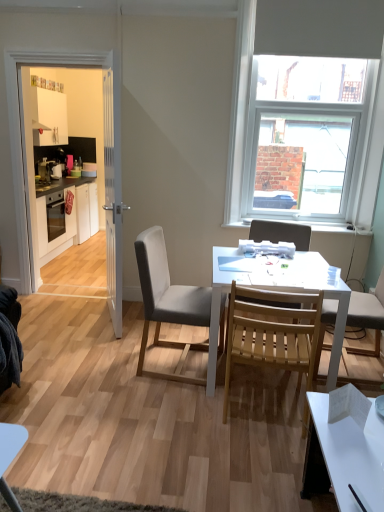
Question: Considering the relative sizes of white wooden door at left and white glossy door at left in the image provided, is white wooden door at left thinner than white glossy door at left?

Choices:
 (A) yes
 (B) no

Answer: (B)

Question: Is white glossy door at left located within white wooden door at left?

Choices:
 (A) no
 (B) yes

Answer: (A)

Question: From the image's perspective, is white wooden door at left under white glossy door at left?

Choices:
 (A) yes
 (B) no

Answer: (A)

Question: Can you confirm if white wooden door at left is bigger than white glossy door at left?

Choices:
 (A) yes
 (B) no

Answer: (A)

Question: Does white wooden door at left have a lesser height compared to white glossy door at left?

Choices:
 (A) no
 (B) yes

Answer: (B)

Question: Is white wooden door at left aimed at white glossy door at left?

Choices:
 (A) no
 (B) yes

Answer: (A)

Question: Does wooden slats chair at center, marked as the third chair in a left-to-right arrangement, have a greater height compared to white matte window at upper right?

Choices:
 (A) yes
 (B) no

Answer: (B)

Question: Is wooden slats chair at center, marked as the third chair in a left-to-right arrangement, smaller than white matte window at upper right?

Choices:
 (A) yes
 (B) no

Answer: (A)

Question: Considering the relative sizes of wooden slats chair at center, marked as the third chair in a left-to-right arrangement, and white matte window at upper right in the image provided, is wooden slats chair at center, marked as the third chair in a left-to-right arrangement, wider than white matte window at upper right?

Choices:
 (A) no
 (B) yes

Answer: (B)

Question: Considering the relative sizes of wooden slats chair at center, the first chair viewed from the right, and white matte window at upper right in the image provided, is wooden slats chair at center, the first chair viewed from the right, thinner than white matte window at upper right?

Choices:
 (A) yes
 (B) no

Answer: (B)

Question: Is wooden slats chair at center, marked as the third chair in a left-to-right arrangement, not close to white matte window at upper right?

Choices:
 (A) no
 (B) yes

Answer: (A)

Question: Does wooden slats chair at center, marked as the third chair in a left-to-right arrangement, have a larger size compared to white matte window at upper right?

Choices:
 (A) yes
 (B) no

Answer: (B)

Question: Is metallic silver toaster at left not inside white glossy cabinets at left?

Choices:
 (A) no
 (B) yes

Answer: (B)